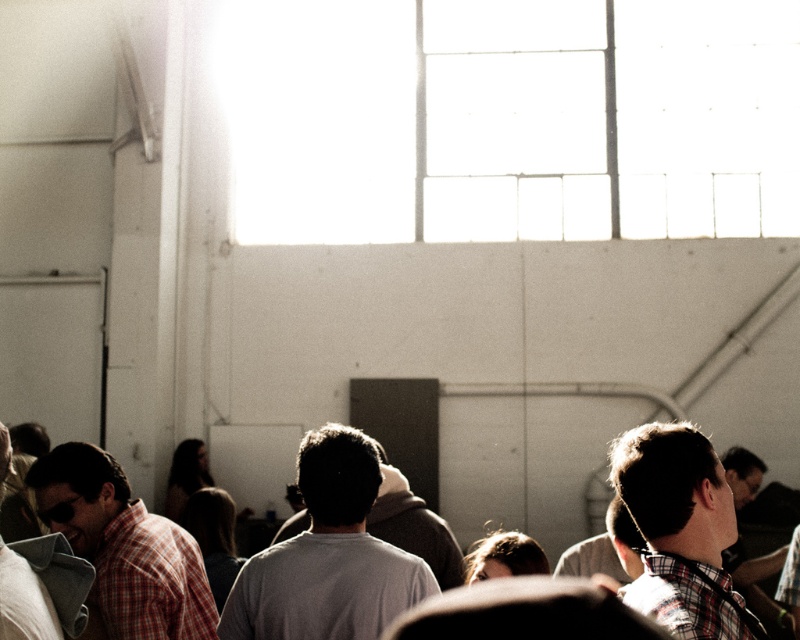
Question: Is plaid cotton shirt at right positioned at the back of matte gray shirt at lower left?

Choices:
 (A) yes
 (B) no

Answer: (B)

Question: Which point is closer to the camera taking this photo?

Choices:
 (A) (202, 593)
 (B) (350, 456)

Answer: (B)

Question: Which point appears closest to the camera in this image?

Choices:
 (A) (124, 493)
 (B) (724, 605)
 (C) (345, 531)

Answer: (B)

Question: Does gray matte shirt at center have a greater width compared to plaid shirt at left?

Choices:
 (A) no
 (B) yes

Answer: (B)

Question: Is gray cotton shirt at center bigger than plaid shirt at left?

Choices:
 (A) yes
 (B) no

Answer: (A)

Question: Which object is positioned closest to the plaid cotton shirt at right?

Choices:
 (A) plaid shirt at left
 (B) matte gray shirt at lower left
 (C) gray cotton shirt at center

Answer: (B)